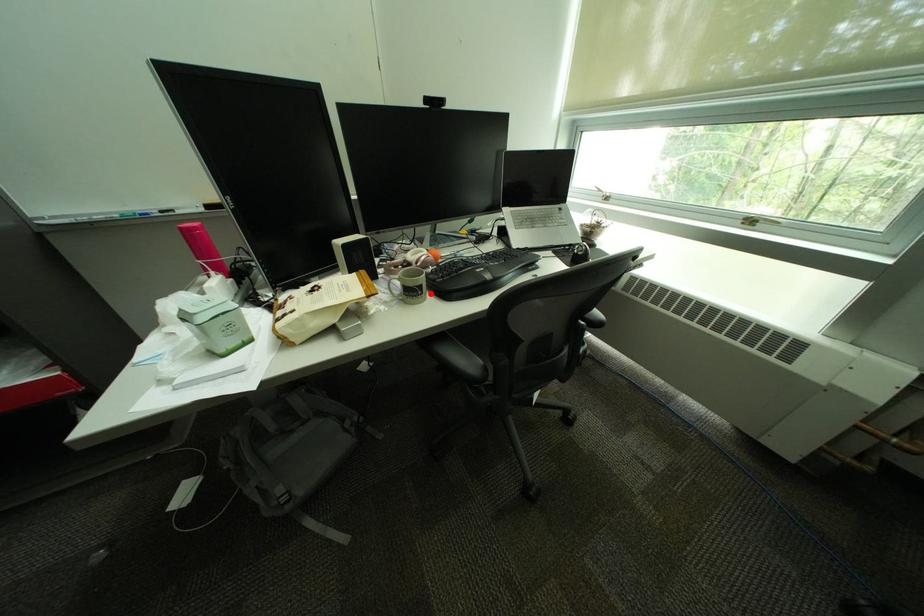
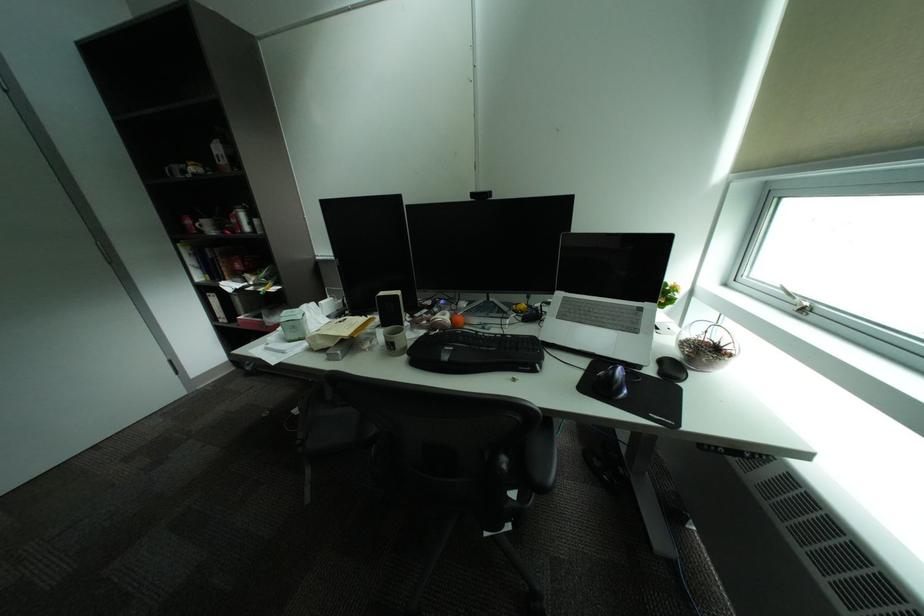
The point at the highlighted location is marked in the first image. Where is the corresponding point in the second image?

(403, 349)